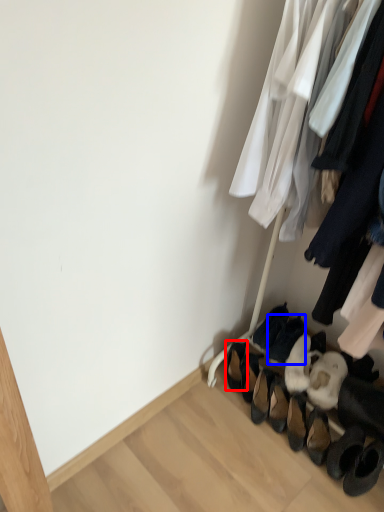
Question: Which point is further to the camera, footwear (highlighted by a red box) or footwear (highlighted by a blue box)?

Choices:
 (A) footwear
 (B) footwear

Answer: (A)